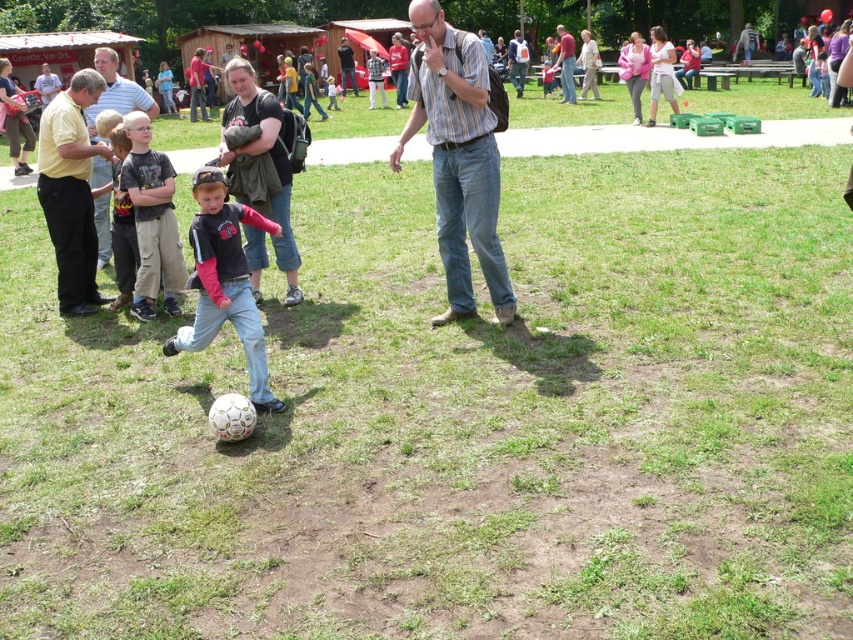
Can you confirm if matte gray shirt at center is thinner than matte gray backpack at center?

Yes.

In the scene shown: Which of these two, matte gray shirt at center or matte gray backpack at center, stands shorter?

Standing shorter between the two is matte gray shirt at center.

Which is in front, point (561, 77) or point (518, 84)?

Positioned in front is point (561, 77).

Find the location of `matte gray shirt at center`. matte gray shirt at center is located at coordinates (566, 65).

Can you confirm if striped cotton shirt at center is wider than matte black shirt at center?

Indeed, striped cotton shirt at center has a greater width compared to matte black shirt at center.

Is striped cotton shirt at center bigger than matte black shirt at center?

Correct, striped cotton shirt at center is larger in size than matte black shirt at center.

Who is more forward, (x=480, y=93) or (x=281, y=403)?

Point (x=281, y=403) is in front.

The height and width of the screenshot is (640, 853). What are the coordinates of `striped cotton shirt at center` in the screenshot? It's located at (457, 157).

Between matte black backpack at center and matte black shirt at center, which one has more height?

matte black shirt at center is taller.

Is point (225, 68) farther from camera compared to point (235, 291)?

Yes, it is behind point (235, 291).

Which is behind, point (257, 156) or point (216, 172)?

The point (257, 156) is behind.

You are a GUI agent. You are given a task and a screenshot of the screen. Output one action in this format:
    pyautogui.click(x=<x>, y=<y>)
    Task: Click on the matte black backpack at center
    The image size is (853, 640).
    Given the screenshot: What is the action you would take?
    pyautogui.click(x=262, y=161)